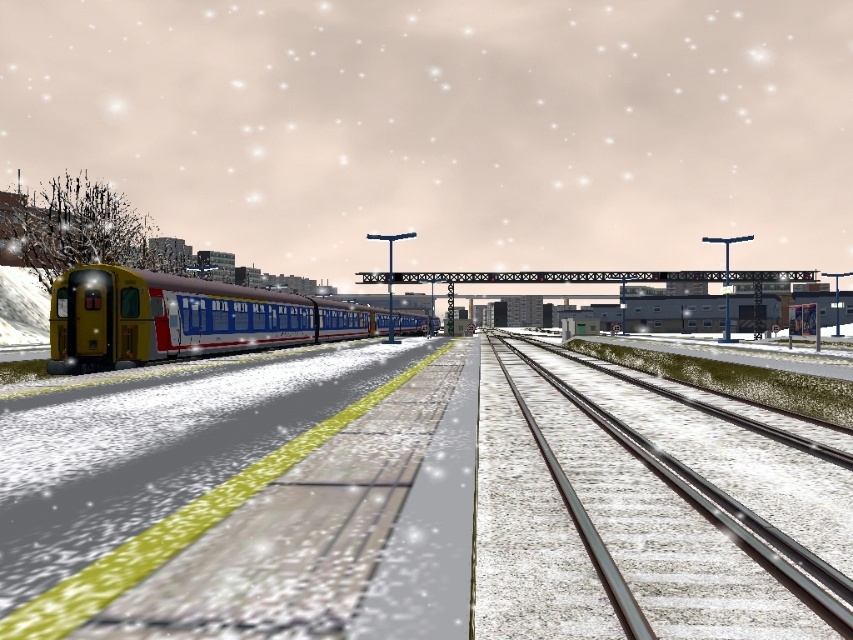
Question: Is metal/smooth tracks at lower right positioned before yellow matte train at left?

Choices:
 (A) no
 (B) yes

Answer: (B)

Question: Which point is farther from the camera taking this photo?

Choices:
 (A) (146, 282)
 (B) (698, 604)

Answer: (A)

Question: Is metal/smooth tracks at lower right below yellow matte train at left?

Choices:
 (A) no
 (B) yes

Answer: (B)

Question: Which point is farther to the camera?

Choices:
 (A) yellow matte train at left
 (B) metal/smooth tracks at lower right

Answer: (A)

Question: Is metal/smooth tracks at lower right to the left of yellow matte train at left from the viewer's perspective?

Choices:
 (A) no
 (B) yes

Answer: (A)

Question: Which of the following is the closest to the observer?

Choices:
 (A) metal/smooth tracks at lower right
 (B) yellow matte train at left

Answer: (A)